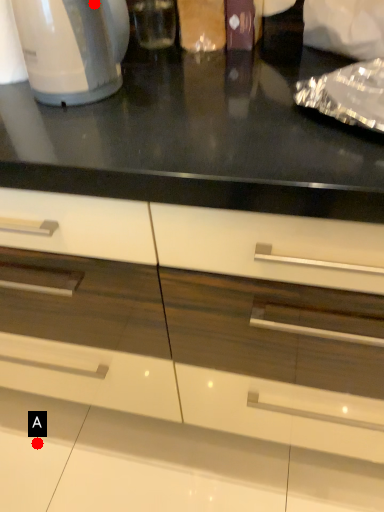
Question: Two points are circled on the image, labeled by A and B beside each circle. Which point is closer to the camera?

Choices:
 (A) A is closer
 (B) B is closer

Answer: (B)